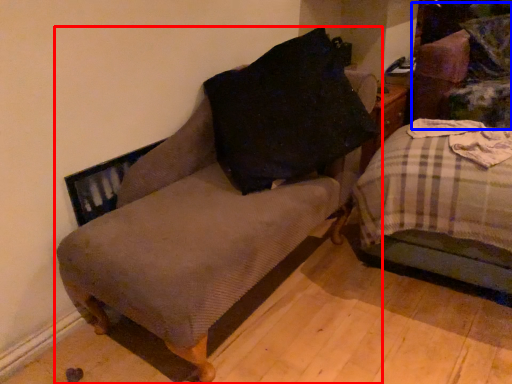
Question: Which of the following is the farthest to the observer, furniture (highlighted by a red box) or swivel chair (highlighted by a blue box)?

Choices:
 (A) furniture
 (B) swivel chair

Answer: (B)